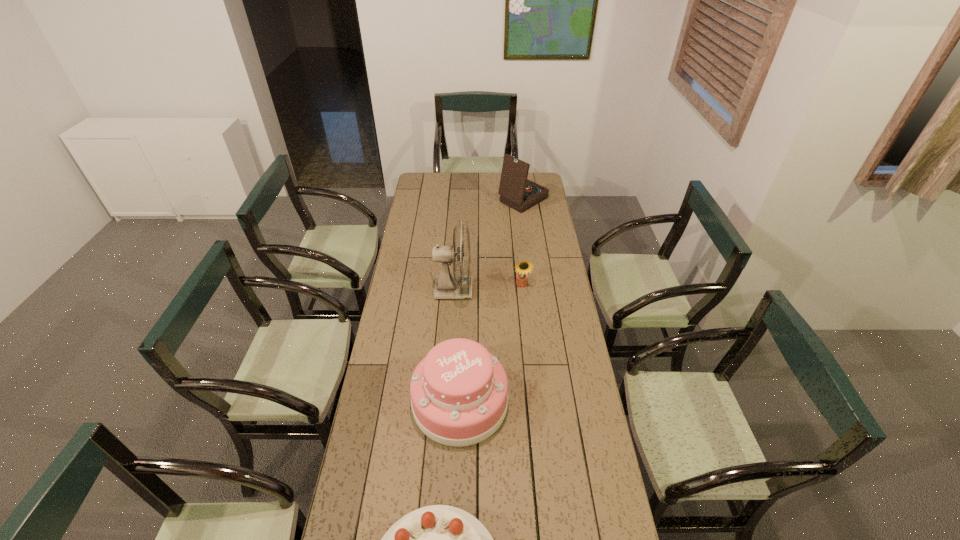
The width and height of the screenshot is (960, 540). Identify the location of object present at the far edge. (516, 191).

Identify the location of object that is at the left edge. (459, 392).

Locate an element on the screen. The width and height of the screenshot is (960, 540). phonograph record present at the right edge is located at coordinates [516, 191].

Locate an element on the screen. The width and height of the screenshot is (960, 540). sunflower present at the right edge is located at coordinates (523, 267).

Locate an element on the screen. object present at the far right corner is located at coordinates (516, 191).

This screenshot has width=960, height=540. What are the coordinates of `vacant space at the left edge` in the screenshot? It's located at (418, 301).

The image size is (960, 540). I want to click on free space at the right edge of the desktop, so click(x=586, y=519).

Locate an element on the screen. The image size is (960, 540). vacant area at the far left corner of the desktop is located at coordinates (426, 178).

At what (x,y) coordinates should I click in order to perform the action: click on vacant region between the fan and the sunflower. Please return your answer as a coordinate pair (x, y). The image size is (960, 540). Looking at the image, I should click on (488, 288).

The height and width of the screenshot is (540, 960). I want to click on vacant point located between the fourth shortest object and the fan, so click(489, 245).